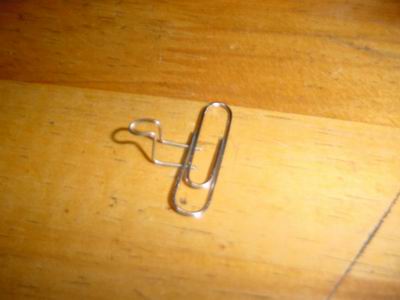
Find the location of a particular element. This screenshot has height=300, width=400. dust is located at coordinates (222, 246), (184, 199), (115, 200).